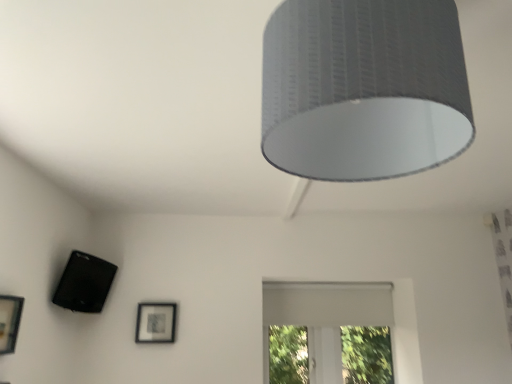
Question: Is matte black picture frame at lower center, which appears as the first picture frame when viewed from the back, bigger than matte black picture frame at lower left, the 1th picture frame in the top-to-bottom sequence?

Choices:
 (A) no
 (B) yes

Answer: (A)

Question: Considering the relative sizes of matte black picture frame at lower center, which ranks as the second picture frame in top-to-bottom order, and matte black picture frame at lower left, the first picture frame viewed from the front, in the image provided, is matte black picture frame at lower center, which ranks as the second picture frame in top-to-bottom order, thinner than matte black picture frame at lower left, the first picture frame viewed from the front,?

Choices:
 (A) no
 (B) yes

Answer: (B)

Question: Can you confirm if matte black picture frame at lower center, which appears as the second picture frame when viewed from the front, is wider than matte black picture frame at lower left, the first picture frame viewed from the front?

Choices:
 (A) no
 (B) yes

Answer: (A)

Question: From a real-world perspective, does matte black picture frame at lower center, placed as the first picture frame when sorted from bottom to top, stand above matte black picture frame at lower left, the first picture frame viewed from the front?

Choices:
 (A) no
 (B) yes

Answer: (B)

Question: Is matte black picture frame at lower center, placed as the first picture frame when sorted from bottom to top, next to matte black picture frame at lower left, acting as the first picture frame starting from the left?

Choices:
 (A) yes
 (B) no

Answer: (B)

Question: From a real-world perspective, is matte black picture frame at lower center, which ranks as the second picture frame in top-to-bottom order, below matte black picture frame at lower left, arranged as the 2th picture frame when ordered from the bottom?

Choices:
 (A) yes
 (B) no

Answer: (B)

Question: Does matte black picture frame at lower left, the 1th picture frame in the top-to-bottom sequence, come behind textured gray lampshade at upper center?

Choices:
 (A) yes
 (B) no

Answer: (A)

Question: From the image's perspective, is matte black picture frame at lower left, arranged as the 2th picture frame when ordered from the bottom, beneath textured gray lampshade at upper center?

Choices:
 (A) yes
 (B) no

Answer: (A)

Question: From a real-world perspective, is matte black picture frame at lower left, arranged as the 2th picture frame when ordered from the bottom, on top of textured gray lampshade at upper center?

Choices:
 (A) yes
 (B) no

Answer: (B)

Question: Is matte black picture frame at lower left, acting as the first picture frame starting from the left, thinner than textured gray lampshade at upper center?

Choices:
 (A) yes
 (B) no

Answer: (A)

Question: Can you confirm if matte black picture frame at lower left, the first picture frame viewed from the front, is positioned to the right of textured gray lampshade at upper center?

Choices:
 (A) no
 (B) yes

Answer: (A)

Question: Considering the relative positions of matte black picture frame at lower left, the second picture frame from the right, and textured gray lampshade at upper center in the image provided, is matte black picture frame at lower left, the second picture frame from the right, in front of textured gray lampshade at upper center?

Choices:
 (A) no
 (B) yes

Answer: (A)

Question: Can you confirm if matte black picture frame at lower center, placed as the first picture frame when sorted from bottom to top, is taller than white matte window at center?

Choices:
 (A) no
 (B) yes

Answer: (A)